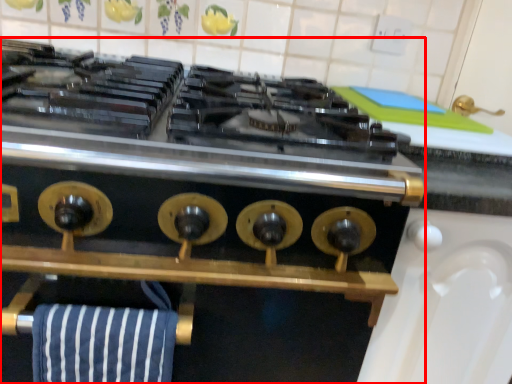
Question: From the image's perspective, what is the correct spatial relationship of kitchen appliance (annotated by the red box) in relation to beach towel?

Choices:
 (A) below
 (B) above

Answer: (A)